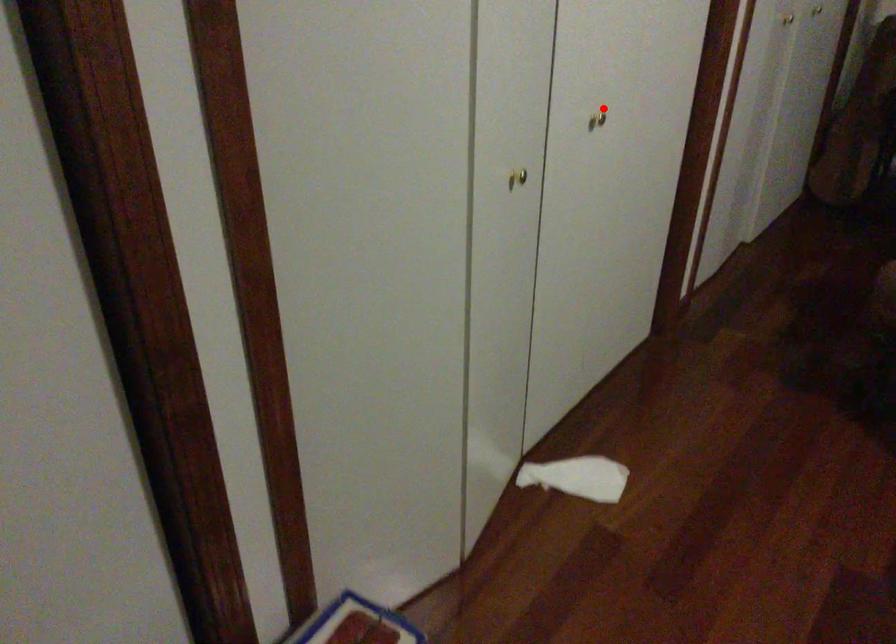
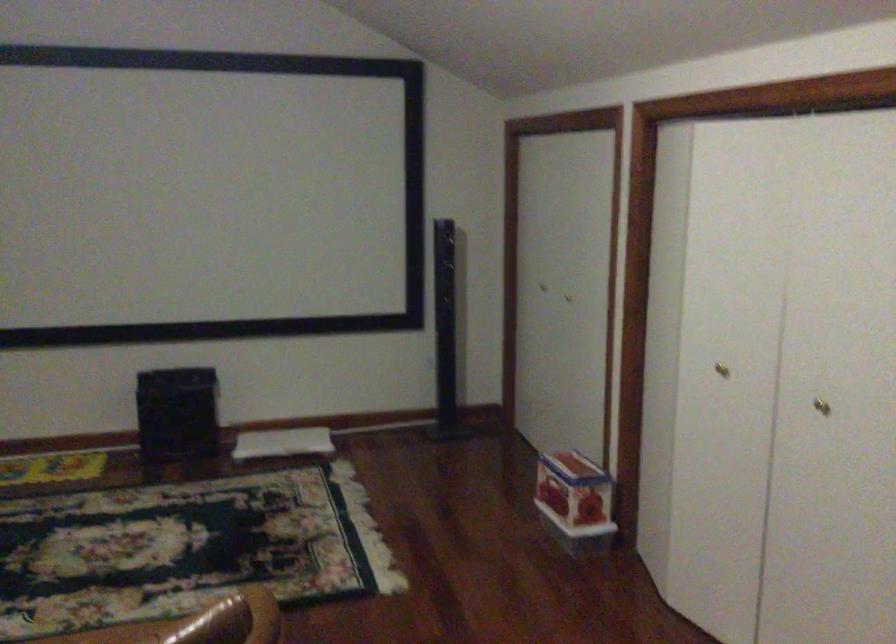
Question: A red point is marked in image1. In image2, is the corresponding 3D point closer to the camera or farther? Reply with the corresponding letter.

Choices:
 (A) The corresponding 3D point is closer.
 (B) The corresponding 3D point is farther.

Answer: (B)